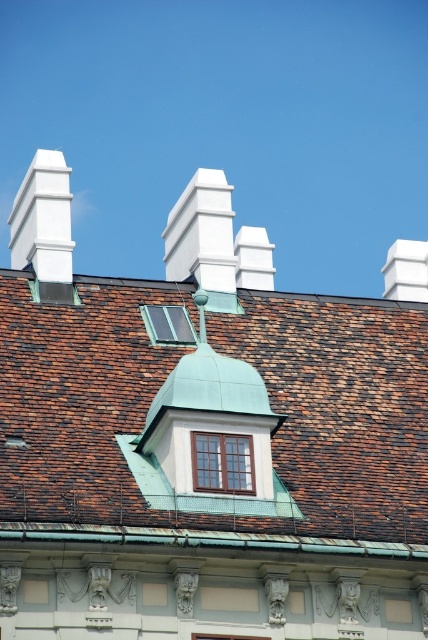
Question: Considering the relative positions of brown shingles at center and clear glass window at center in the image provided, where is brown shingles at center located with respect to clear glass window at center?

Choices:
 (A) left
 (B) right

Answer: (A)

Question: Which point is farther to the camera?

Choices:
 (A) (196, 449)
 (B) (243, 324)
 (C) (155, 316)

Answer: (B)

Question: Which of these objects is positioned farthest from the clear glass window at center?

Choices:
 (A) transparent glass window at center
 (B) brown shingles at center

Answer: (A)

Question: Is brown shingles at center bigger than clear glass window at center?

Choices:
 (A) yes
 (B) no

Answer: (A)

Question: Does brown shingles at center lie behind transparent glass window at center?

Choices:
 (A) yes
 (B) no

Answer: (B)

Question: Considering the real-world distances, which object is farthest from the clear glass window at center?

Choices:
 (A) transparent glass window at center
 (B) brown shingles at center

Answer: (A)